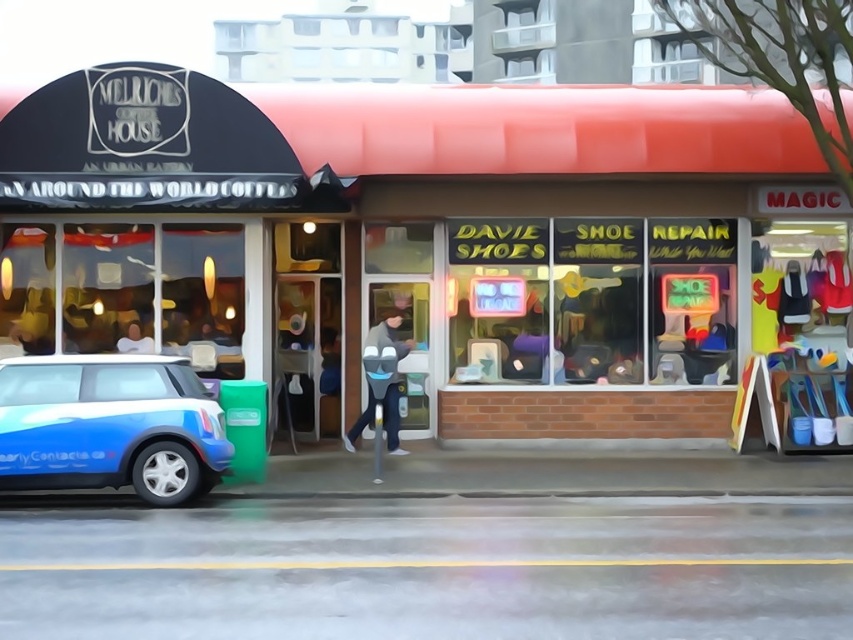
Question: Estimate the real-world distances between objects in this image. Which object is farther from the gray fabric jacket at center?

Choices:
 (A) blue matte toy car at lower left
 (B) smooth skin face at upper center
 (C) brick storefront at center

Answer: (B)

Question: Estimate the real-world distances between objects in this image. Which object is closer to the brick storefront at center?

Choices:
 (A) smooth skin face at upper center
 (B) gray fabric jacket at center
 (C) blue matte toy car at lower left

Answer: (B)

Question: Can you confirm if blue matte toy car at lower left is wider than gray fabric jacket at center?

Choices:
 (A) yes
 (B) no

Answer: (A)

Question: Where is blue matte toy car at lower left located in relation to smooth skin face at upper center in the image?

Choices:
 (A) above
 (B) below

Answer: (B)

Question: Does blue matte toy car at lower left have a smaller size compared to gray fabric jacket at center?

Choices:
 (A) yes
 (B) no

Answer: (B)

Question: Which is farther from the smooth skin face at upper center?

Choices:
 (A) brick storefront at center
 (B) blue matte toy car at lower left
 (C) gray fabric jacket at center

Answer: (A)